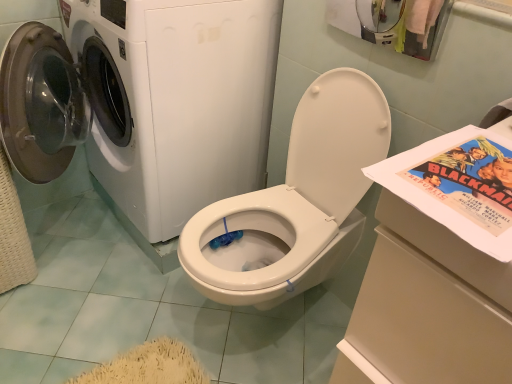
Question: Is white glossy washer at upper left aimed at matte paper comic book at right?

Choices:
 (A) no
 (B) yes

Answer: (A)

Question: Can you confirm if white glossy washer at upper left is positioned to the right of matte paper comic book at right?

Choices:
 (A) no
 (B) yes

Answer: (A)

Question: Does white glossy washer at upper left have a greater width compared to matte paper comic book at right?

Choices:
 (A) yes
 (B) no

Answer: (A)

Question: Is the position of white glossy washer at upper left more distant than that of matte paper comic book at right?

Choices:
 (A) no
 (B) yes

Answer: (B)

Question: From the image's perspective, does white glossy washer at upper left appear higher than matte paper comic book at right?

Choices:
 (A) yes
 (B) no

Answer: (B)

Question: Considering the positions of white glossy washer at upper left and white glossy washing machine at left in the image, is white glossy washer at upper left taller or shorter than white glossy washing machine at left?

Choices:
 (A) short
 (B) tall

Answer: (A)

Question: Considering the positions of point (218, 291) and point (249, 52), is point (218, 291) closer or farther from the camera than point (249, 52)?

Choices:
 (A) closer
 (B) farther

Answer: (A)

Question: Considering the positions of white glossy washer at upper left and white glossy washing machine at left in the image, is white glossy washer at upper left wider or thinner than white glossy washing machine at left?

Choices:
 (A) thin
 (B) wide

Answer: (A)

Question: Considering the relative positions of white glossy washer at upper left and white glossy washing machine at left in the image provided, is white glossy washer at upper left to the left or to the right of white glossy washing machine at left?

Choices:
 (A) left
 (B) right

Answer: (B)

Question: From their relative heights in the image, would you say matte paper comic book at right is taller or shorter than white glossy washer at upper left?

Choices:
 (A) tall
 (B) short

Answer: (B)

Question: Considering their positions, is matte paper comic book at right located in front of or behind white glossy washer at upper left?

Choices:
 (A) behind
 (B) front

Answer: (B)

Question: From the image's perspective, relative to white glossy washer at upper left, is matte paper comic book at right above or below?

Choices:
 (A) below
 (B) above

Answer: (B)

Question: Is matte paper comic book at right to the left or to the right of white glossy washer at upper left in the image?

Choices:
 (A) right
 (B) left

Answer: (A)

Question: Based on their positions, is white glossy washing machine at left located to the left or right of matte paper comic book at right?

Choices:
 (A) left
 (B) right

Answer: (A)

Question: In terms of height, does white glossy washing machine at left look taller or shorter compared to matte paper comic book at right?

Choices:
 (A) tall
 (B) short

Answer: (A)